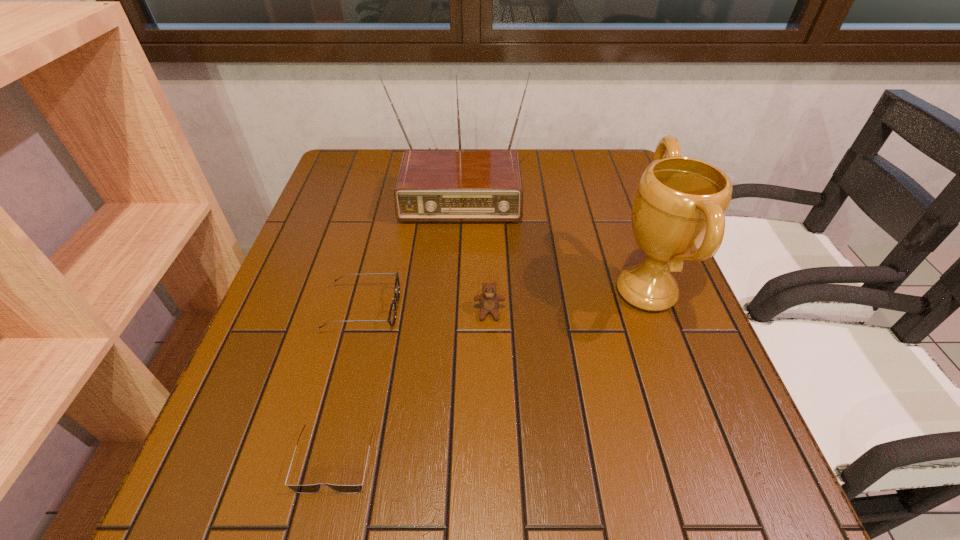
The image size is (960, 540). What are the coordinates of `the closest object to the farthest object` in the screenshot? It's located at (678, 213).

Identify the location of the third closest object relative to the farthest object. The image size is (960, 540). (489, 301).

The height and width of the screenshot is (540, 960). In order to click on free space that satisfies the following two spatial constraints: 1. on the front panel of the radio_receiver; 2. through the lenses of the spectacles in this screenshot , I will do `click(450, 309)`.

Where is `vacant space that satisfies the following two spatial constraints: 1. on the front panel of the farthest object; 2. through the lenses of the second shortest object`? The width and height of the screenshot is (960, 540). vacant space that satisfies the following two spatial constraints: 1. on the front panel of the farthest object; 2. through the lenses of the second shortest object is located at coordinates (450, 309).

Identify the location of free space that satisfies the following two spatial constraints: 1. on the front of the rightmost object with the decoration; 2. on the front-facing side of the sunglasses. Image resolution: width=960 pixels, height=540 pixels. (708, 460).

Where is `free space in the image that satisfies the following two spatial constraints: 1. on the front of the rightmost object with the decoration; 2. on the front-facing side of the sunglasses`? This screenshot has height=540, width=960. free space in the image that satisfies the following two spatial constraints: 1. on the front of the rightmost object with the decoration; 2. on the front-facing side of the sunglasses is located at coordinates (708, 460).